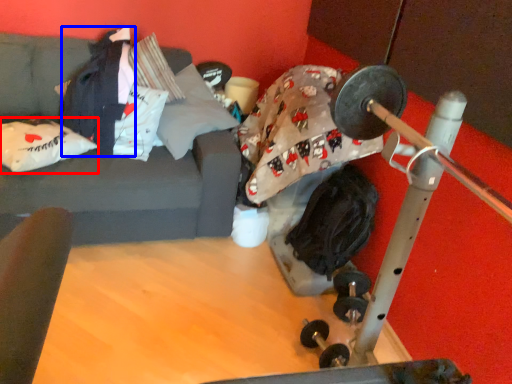
Question: Which object appears farthest to the camera in this image, pillow (highlighted by a red box) or clothing (highlighted by a blue box)?

Choices:
 (A) pillow
 (B) clothing

Answer: (B)